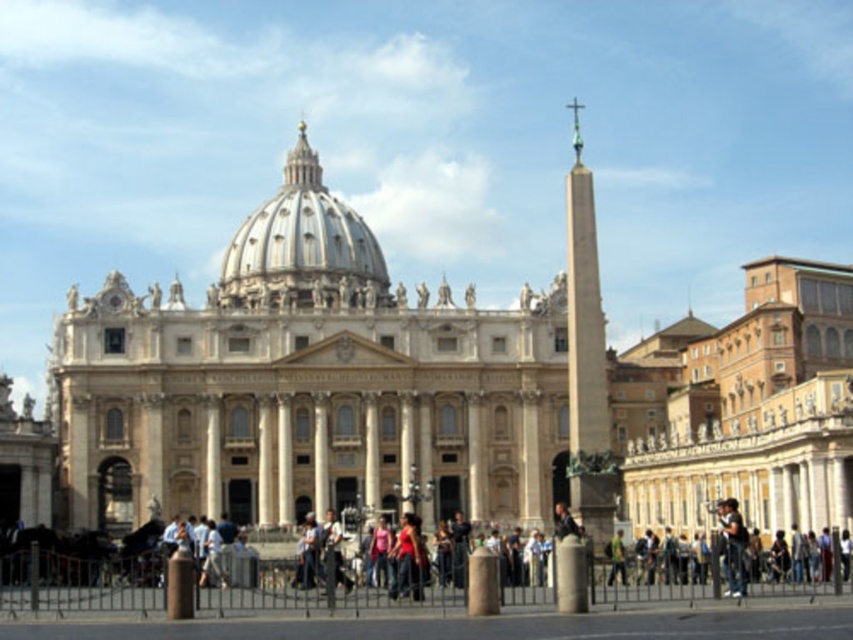
Question: Which object appears closest to the camera in this image?

Choices:
 (A) white marble dome at center
 (B) dark blue jeans at lower right

Answer: (B)

Question: Among these objects, which one is farthest from the camera?

Choices:
 (A) white marble dome at center
 (B) dark blue jeans at lower right

Answer: (A)

Question: Does white marble dome at center have a smaller size compared to dark blue jeans at lower right?

Choices:
 (A) yes
 (B) no

Answer: (B)

Question: Is white marble dome at center smaller than dark blue jeans at lower right?

Choices:
 (A) yes
 (B) no

Answer: (B)

Question: Can you confirm if white marble dome at center is positioned below dark blue jeans at lower right?

Choices:
 (A) no
 (B) yes

Answer: (A)